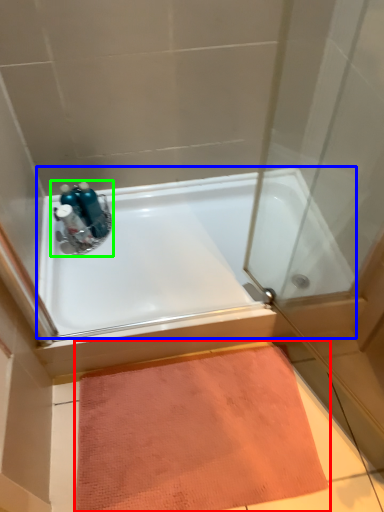
Question: Which object is the closest to the doormat (highlighted by a red box)? Choose among these: bathtub (highlighted by a blue box) or sink (highlighted by a green box).

Choices:
 (A) bathtub
 (B) sink

Answer: (A)